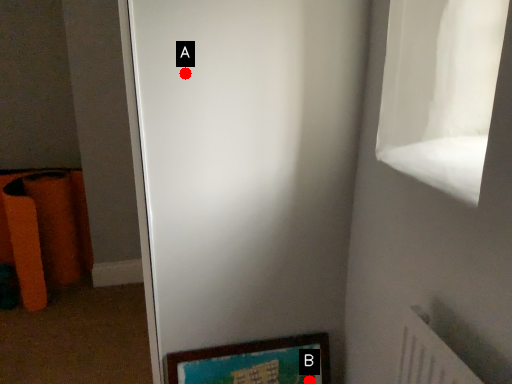
Question: Two points are circled on the image, labeled by A and B beside each circle. Which point is farther from the camera taking this photo?

Choices:
 (A) A is further
 (B) B is further

Answer: (B)